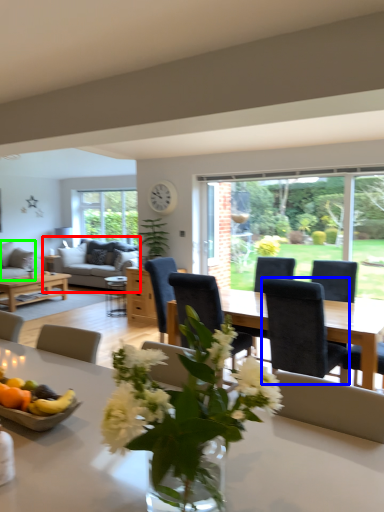
Question: Which object is positioned farthest from studio couch (highlighted by a red box)? Select from chair (highlighted by a blue box) and studio couch (highlighted by a green box).

Choices:
 (A) chair
 (B) studio couch

Answer: (A)